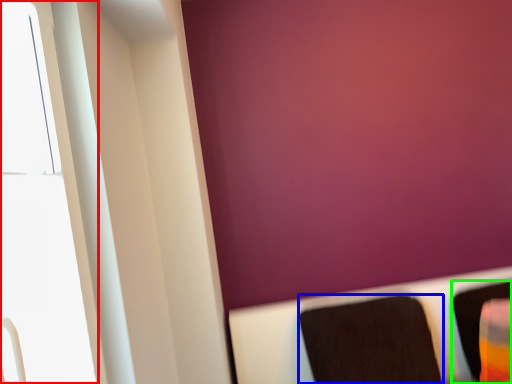
Question: Based on their relative distances, which object is nearer to window (highlighted by a red box)? Choose from furniture (highlighted by a blue box) and furniture (highlighted by a green box).

Choices:
 (A) furniture
 (B) furniture

Answer: (A)